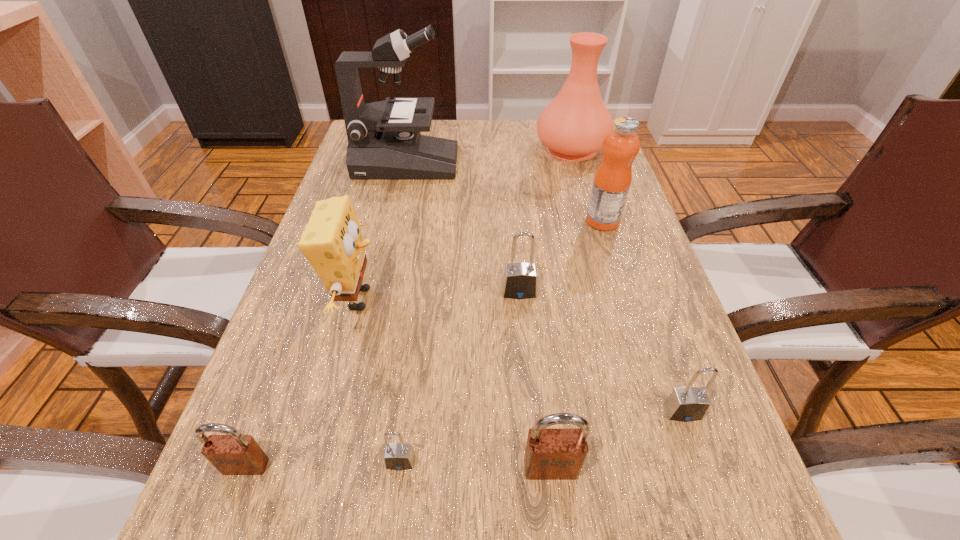
Locate an element on the screen. This screenshot has height=540, width=960. free spot between the fruit juice and the second tallest object is located at coordinates [588, 185].

You are a GUI agent. You are given a task and a screenshot of the screen. Output one action in this format:
    pyautogui.click(x=<x>, y=<y>)
    Task: Click on the free spot between the smaller brown padlock and the sponge
    
    Given the screenshot: What is the action you would take?
    pyautogui.click(x=301, y=382)

Identify which object is the third closest to the microscope. Please provide its 2D coordinates. Your answer should be formatted as a tuple, i.e. [(x, y)], where the tuple contains the x and y coordinates of a point satisfying the conditions above.

[(612, 180)]

Select which object is the eighth closest to the second farthest gray padlock. Please provide its 2D coordinates. Your answer should be formatted as a tuple, i.e. [(x, y)], where the tuple contains the x and y coordinates of a point satisfying the conditions above.

[(384, 141)]

Identify which padlock is the second nearest to the second gray padlock from left to right. Please provide its 2D coordinates. Your answer should be formatted as a tuple, i.e. [(x, y)], where the tuple contains the x and y coordinates of a point satisfying the conditions above.

[(551, 454)]

Locate an element on the screen. padlock that is the nearest to the nearest gray padlock is located at coordinates (551, 454).

You are a GUI agent. You are given a task and a screenshot of the screen. Output one action in this format:
    pyautogui.click(x=<x>, y=<y>)
    Task: Click on the gray padlock that is the second closest to the leftmost padlock
    The image size is (960, 540).
    Given the screenshot: What is the action you would take?
    pyautogui.click(x=520, y=279)

Find the location of a particular element. The height and width of the screenshot is (540, 960). gray padlock that is the third closest one to the bigger brown padlock is located at coordinates (520, 279).

The width and height of the screenshot is (960, 540). In order to click on brown padlock identified as the second closest to the eighth shortest object in this screenshot , I will do `click(233, 454)`.

Locate an element on the screen. free location that satisfies the following two spatial constraints: 1. on the front side of the second tallest object; 2. on the left side of the third tallest object is located at coordinates (593, 221).